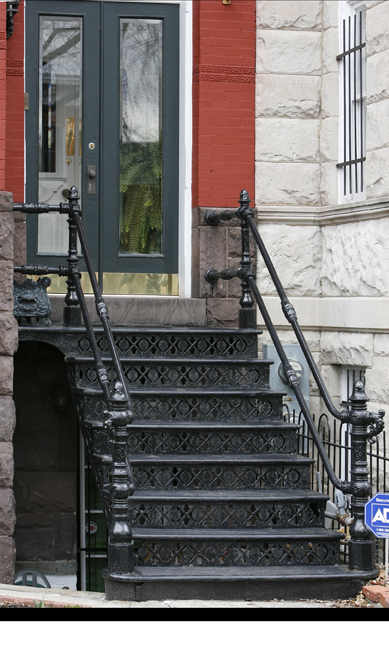
This screenshot has height=652, width=389. Identify the location of window bars. (356, 160).